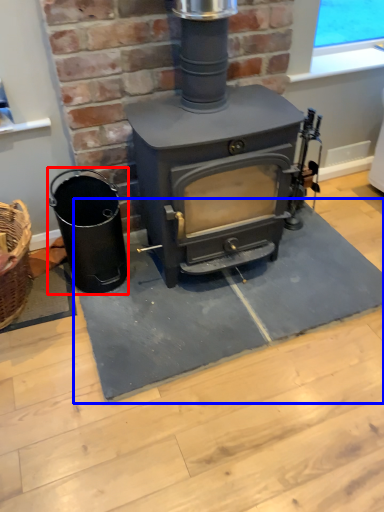
Question: Which object appears farthest to the camera in this image, appliance (highlighted by a red box) or doormat (highlighted by a blue box)?

Choices:
 (A) appliance
 (B) doormat

Answer: (A)